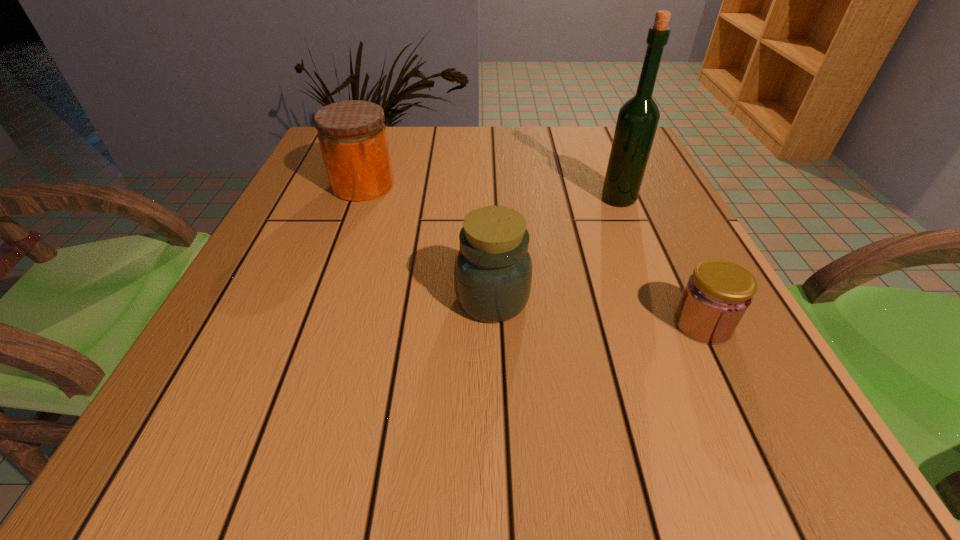
Locate an element on the screen. The width and height of the screenshot is (960, 540). the tallest object is located at coordinates (638, 118).

What are the coordinates of `the left jar` in the screenshot? It's located at (352, 135).

Locate an element on the screen. This screenshot has height=540, width=960. the leftmost object is located at coordinates (352, 135).

The width and height of the screenshot is (960, 540). I want to click on the nearer jar, so click(493, 269).

Locate an element on the screen. The image size is (960, 540). the second object from left to right is located at coordinates (493, 269).

Where is `jam`? jam is located at coordinates (717, 295).

At what (x,y) coordinates should I click in order to perform the action: click on vacant space located 0.270m on the front of the tallest object. Please return your answer as a coordinate pair (x, y). This screenshot has height=540, width=960. Looking at the image, I should click on (660, 299).

Where is `vacant space located 0.220m on the front of the left jar`? The height and width of the screenshot is (540, 960). vacant space located 0.220m on the front of the left jar is located at coordinates (332, 271).

Locate an element on the screen. vacant space located 0.240m on the left of the right jar is located at coordinates (314, 299).

Locate an element on the screen. free space located on the back of the jam is located at coordinates (681, 278).